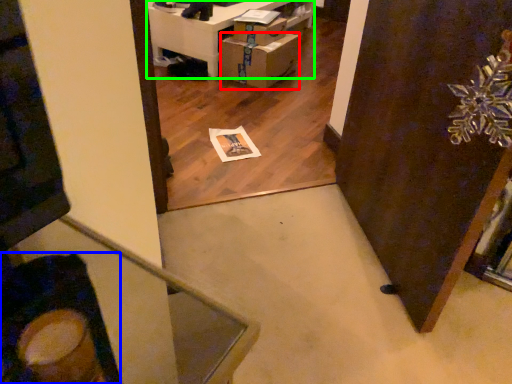
Question: Considering the real-world distances, which object is farthest from cardboard box (highlighted by a red box)? swivel chair (highlighted by a blue box) or furniture (highlighted by a green box)?

Choices:
 (A) swivel chair
 (B) furniture

Answer: (A)